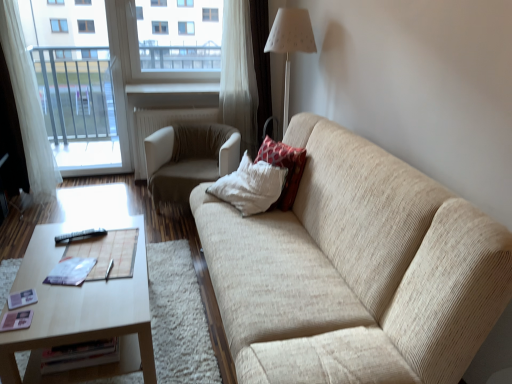
You are a GUI agent. You are given a task and a screenshot of the screen. Output one action in this format:
    pyautogui.click(x=<x>, y=<y>)
    Task: Click on the white fabric lampshade at upper center
    The image size is (512, 384).
    Given the screenshot: What is the action you would take?
    pyautogui.click(x=290, y=43)

What are the coordinates of `white sheer curtain at left` in the screenshot? It's located at (28, 106).

This screenshot has height=384, width=512. Describe the element at coordinates (28, 106) in the screenshot. I see `white sheer curtain at left` at that location.

This screenshot has width=512, height=384. What are the coordinates of `light brown wooden coffee table at lower left` in the screenshot? It's located at (87, 284).

Describe the element at coordinates (80, 108) in the screenshot. Image resolution: width=512 pixels, height=384 pixels. I see `metallic silver screen door at left` at that location.

Locate an element on the screen. The height and width of the screenshot is (384, 512). transparent glass window at upper center is located at coordinates click(x=176, y=38).

The image size is (512, 384). Describe the element at coordinates (284, 167) in the screenshot. I see `red textured pillow at upper right` at that location.

This screenshot has width=512, height=384. What are the coordinates of `white fabric lampshade at upper center` in the screenshot? It's located at (290, 43).

How far apart are beige fabric couch at center and beige fabric chair at center?

beige fabric couch at center and beige fabric chair at center are 1.18 meters apart from each other.

Is beige fabric couch at center aimed at beige fabric chair at center?

No, beige fabric couch at center is not turned towards beige fabric chair at center.

Is beige fabric couch at center positioned beyond the bounds of beige fabric chair at center?

Yes, beige fabric couch at center is located beyond the bounds of beige fabric chair at center.

Considering the sizes of beige fabric couch at center and beige fabric chair at center in the image, is beige fabric couch at center taller or shorter than beige fabric chair at center?

Clearly, beige fabric couch at center is taller compared to beige fabric chair at center.

Is beige fabric chair at center not inside red textured pillow at upper right?

Yes, beige fabric chair at center is located beyond the bounds of red textured pillow at upper right.

Can you confirm if beige fabric chair at center is positioned to the right of red textured pillow at upper right?

In fact, beige fabric chair at center is to the left of red textured pillow at upper right.

What's the angular difference between beige fabric chair at center and red textured pillow at upper right's facing directions?

63.2 degrees separate the facing orientations of beige fabric chair at center and red textured pillow at upper right.

From the picture: Is beige fabric chair at center in contact with red textured pillow at upper right?

No, beige fabric chair at center is not with red textured pillow at upper right.

Could you tell me if transparent glass window at upper center is facing metallic silver screen door at left?

No, transparent glass window at upper center does not turn towards metallic silver screen door at left.

Looking at this image, would you say transparent glass window at upper center is outside metallic silver screen door at left?

Yes, transparent glass window at upper center is outside of metallic silver screen door at left.

Which object is positioned more to the left, transparent glass window at upper center or metallic silver screen door at left?

metallic silver screen door at left is more to the left.

Consider the image. Is transparent glass window at upper center positioned behind metallic silver screen door at left?

Yes, it is.

Between beige fabric chair at center and transparent glass window at upper center, which one has less height?

Standing shorter between the two is beige fabric chair at center.

Identify the location of window screen above the beige fabric chair at center (from the image's perspective). (176, 38).

Which is in front, point (223, 171) or point (178, 61)?

The point (223, 171) is closer.

Who is more distant, beige fabric chair at center or transparent glass window at upper center?

Positioned behind is transparent glass window at upper center.

Is beige fabric couch at center far away from white fabric lampshade at upper center?

Indeed, beige fabric couch at center is not near white fabric lampshade at upper center.

Between beige fabric couch at center and white fabric lampshade at upper center, which one is positioned behind?

white fabric lampshade at upper center.

Would you say beige fabric couch at center is inside or outside white fabric lampshade at upper center?

beige fabric couch at center is located beyond the bounds of white fabric lampshade at upper center.

Can you tell me how much beige fabric couch at center and white fabric lampshade at upper center differ in facing direction?

They differ by 3.05 degrees in their facing directions.

Does light brown wooden coffee table at lower left have a smaller size compared to white fabric lampshade at upper center?

No, light brown wooden coffee table at lower left is not smaller than white fabric lampshade at upper center.

You are a GUI agent. You are given a task and a screenshot of the screen. Output one action in this format:
    pyautogui.click(x=<x>, y=<y>)
    Task: Click on the coffee table below the white fabric lampshade at upper center (from a real-world perspective)
    This screenshot has width=512, height=384.
    Given the screenshot: What is the action you would take?
    pyautogui.click(x=87, y=284)

Can you confirm if light brown wooden coffee table at lower left is wider than white fabric lampshade at upper center?

Yes, light brown wooden coffee table at lower left is wider than white fabric lampshade at upper center.

Is light brown wooden coffee table at lower left shorter than white fabric lampshade at upper center?

Correct, light brown wooden coffee table at lower left is not as tall as white fabric lampshade at upper center.

At what (x,y) coordinates should I click in order to perform the action: click on coffee table that is below the metallic silver screen door at left (from the image's perspective). Please return your answer as a coordinate pair (x, y). The height and width of the screenshot is (384, 512). Looking at the image, I should click on (87, 284).

From a real-world perspective, who is located higher, light brown wooden coffee table at lower left or metallic silver screen door at left?

From a 3D spatial view, metallic silver screen door at left is above.

Considering the positions of objects light brown wooden coffee table at lower left and metallic silver screen door at left in the image provided, who is more to the left, light brown wooden coffee table at lower left or metallic silver screen door at left?

metallic silver screen door at left is more to the left.

Locate an element on the screen. The width and height of the screenshot is (512, 384). chair below the beige fabric couch at center (from a real-world perspective) is located at coordinates (188, 159).

This screenshot has height=384, width=512. I want to click on pillow in front of the beige fabric chair at center, so click(284, 167).

Estimate the real-world distances between objects in this image. Which object is further from white fabric lampshade at upper center, beige fabric couch at center or transparent glass window at upper center?

beige fabric couch at center.

Considering their positions, is light brown wooden coffee table at lower left positioned further to beige fabric couch at center than beige fabric chair at center?

beige fabric chair at center is further to beige fabric couch at center.

Considering their positions, is white fabric lampshade at upper center positioned further to red textured pillow at upper right than metallic silver screen door at left?

metallic silver screen door at left.

Looking at the image, which one is located further to metallic silver screen door at left, red textured pillow at upper right or beige fabric chair at center?

red textured pillow at upper right lies further to metallic silver screen door at left than the other object.

When comparing their distances from light brown wooden coffee table at lower left, does metallic silver screen door at left or white fabric lampshade at upper center seem further?

metallic silver screen door at left.

When comparing their distances from metallic silver screen door at left, does white sheer curtain at left or transparent glass window at upper center seem closer?

white sheer curtain at left is closer to metallic silver screen door at left.

Estimate the real-world distances between objects in this image. Which object is further from beige fabric chair at center, beige fabric couch at center or metallic silver screen door at left?

Among the two, beige fabric couch at center is located further to beige fabric chair at center.

From the image, which object appears to be nearer to transparent glass window at upper center, red textured pillow at upper right or light brown wooden coffee table at lower left?

The object closer to transparent glass window at upper center is red textured pillow at upper right.

I want to click on table lamp between transparent glass window at upper center and beige fabric chair at center vertically, so [290, 43].

The width and height of the screenshot is (512, 384). Identify the location of pillow between beige fabric couch at center and white fabric lampshade at upper center along the z-axis. (284, 167).

Find the location of `coffee table positioned between beige fabric couch at center and red textured pillow at upper right from near to far`. coffee table positioned between beige fabric couch at center and red textured pillow at upper right from near to far is located at coordinates (87, 284).

Locate an element on the screen. Image resolution: width=512 pixels, height=384 pixels. screen door situated between white sheer curtain at left and red textured pillow at upper right from left to right is located at coordinates (80, 108).